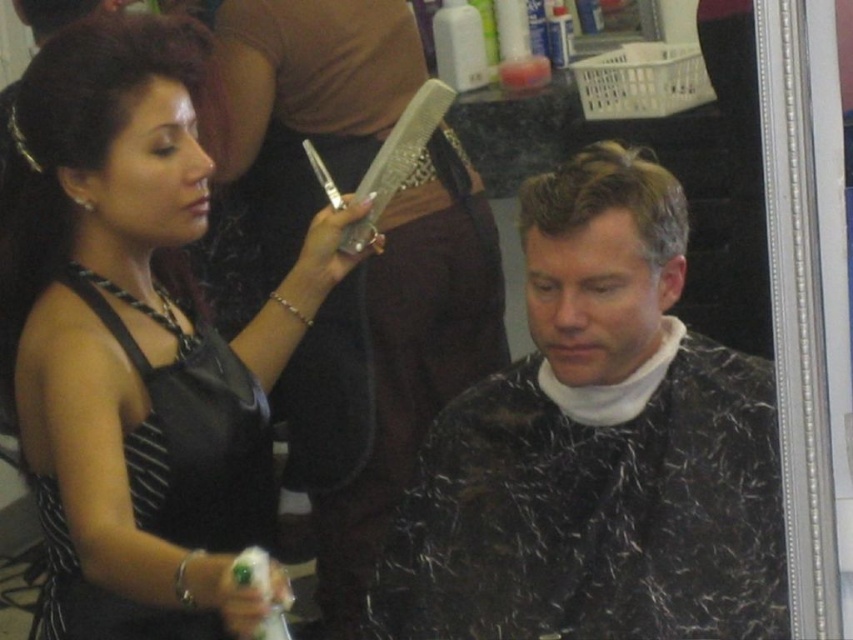
Is slicked matte hair at center below clear plastic comb at upper center?

Yes, slicked matte hair at center is below clear plastic comb at upper center.

Does slicked matte hair at center have a smaller size compared to clear plastic comb at upper center?

Yes, slicked matte hair at center is smaller than clear plastic comb at upper center.

The width and height of the screenshot is (853, 640). I want to click on slicked matte hair at center, so click(x=608, y=198).

Which is in front, point (47, 433) or point (610, 148)?

Point (47, 433) is in front.

In the scene shown: How distant is black leather dress at upper left from slicked matte hair at center?

They are 21.03 inches apart.

Does point (161, 227) lie behind point (635, 202)?

Yes, it is.

Where is `black leather dress at upper left`? The image size is (853, 640). black leather dress at upper left is located at coordinates (136, 340).

Does point (537, 186) come farther from viewer compared to point (421, 140)?

No, it is not.

Is shiny black hair at center thinner than clear plastic comb at upper center?

No.

Is point (726, 486) positioned after point (379, 182)?

No.

Locate an element on the screen. shiny black hair at center is located at coordinates (596, 449).